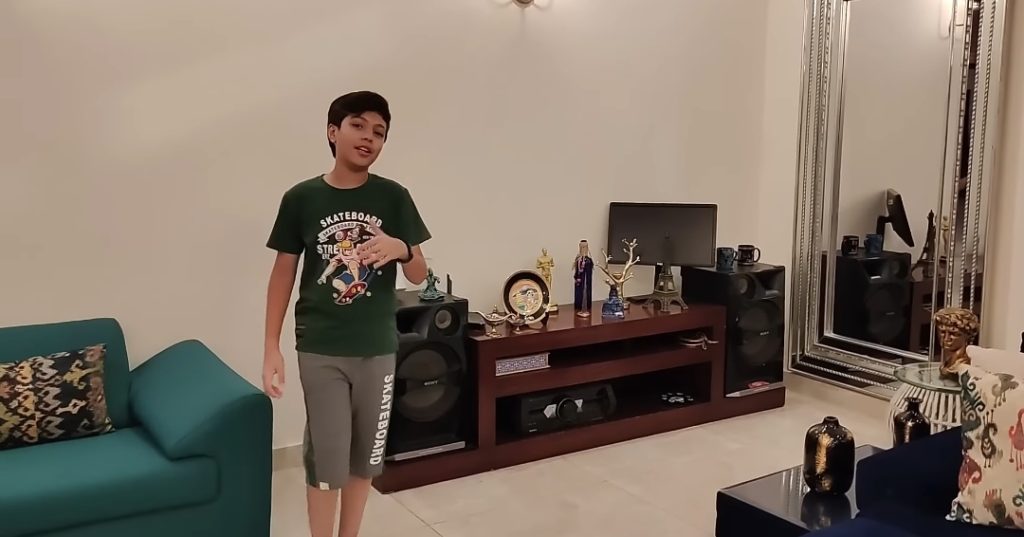
Locate an element on the screen. book is located at coordinates (530, 361).